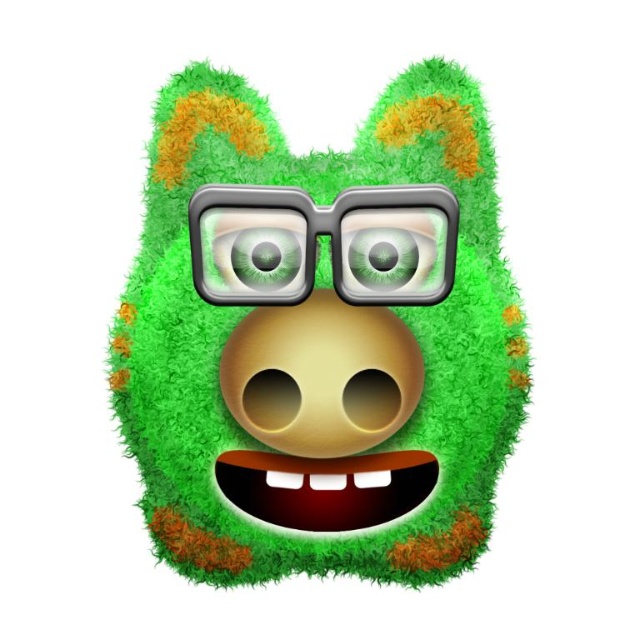
Question: Is fuzzy green creature at center to the left of gold matte/natural nose at center from the viewer's perspective?

Choices:
 (A) no
 (B) yes

Answer: (B)

Question: Which of the following is the closest to the observer?

Choices:
 (A) shiny metallic glasses at center
 (B) fuzzy green creature at center
 (C) green matte eye at center
 (D) green glossy eye at center

Answer: (A)

Question: Is fuzzy green creature at center wider than gold matte/natural nose at center?

Choices:
 (A) yes
 (B) no

Answer: (A)

Question: Which point is closer to the camera?

Choices:
 (A) gold matte/natural nose at center
 (B) shiny metallic glasses at center
 (C) green glossy eye at center
 (D) green matte eye at center

Answer: (B)

Question: Which object is farther from the camera taking this photo?

Choices:
 (A) fuzzy green creature at center
 (B) shiny metallic glasses at center
 (C) green glossy eye at center
 (D) green matte eye at center

Answer: (C)

Question: Is fuzzy green creature at center bigger than green matte eye at center?

Choices:
 (A) yes
 (B) no

Answer: (A)